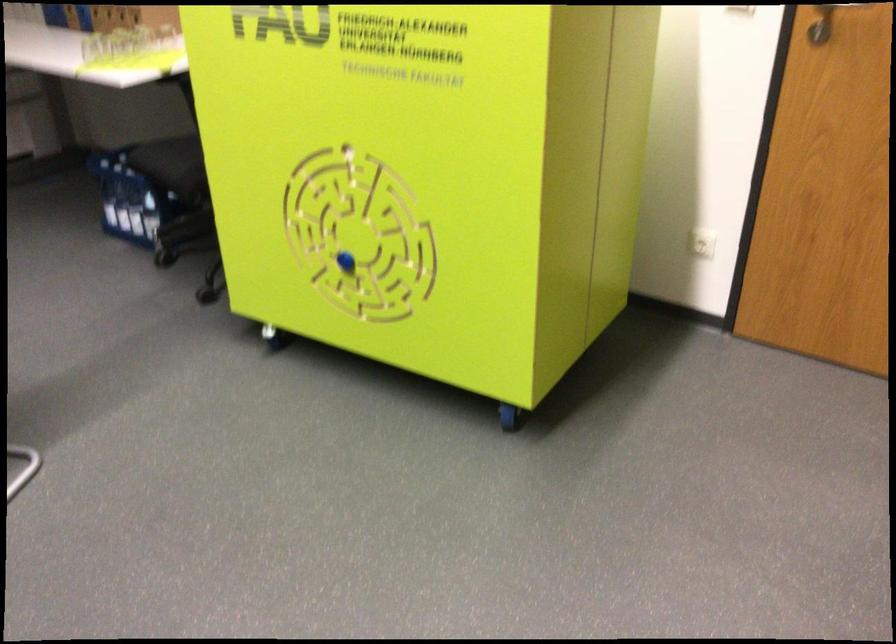
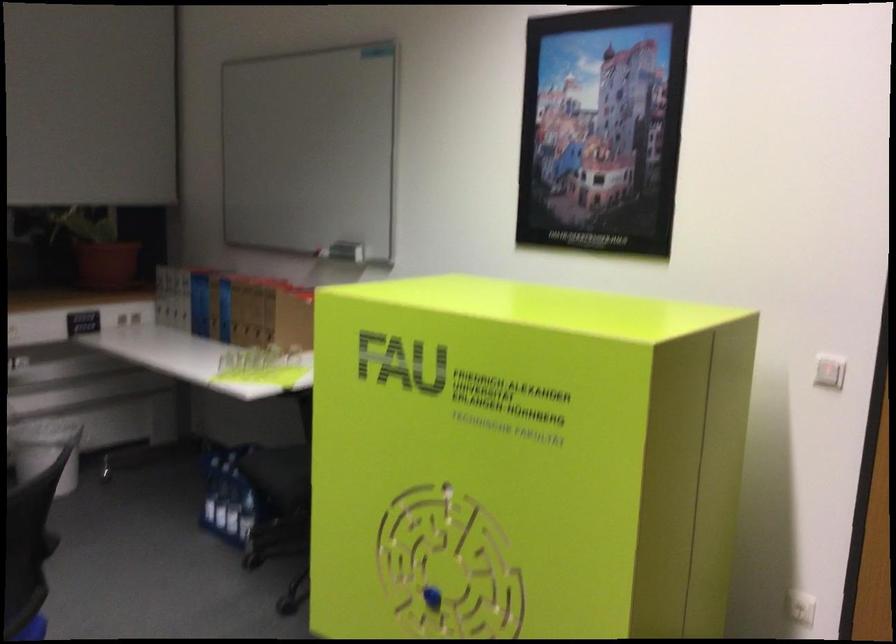
Question: How did the camera likely rotate?

Choices:
 (A) Left
 (B) Right
 (C) Up
 (D) Down

Answer: (C)